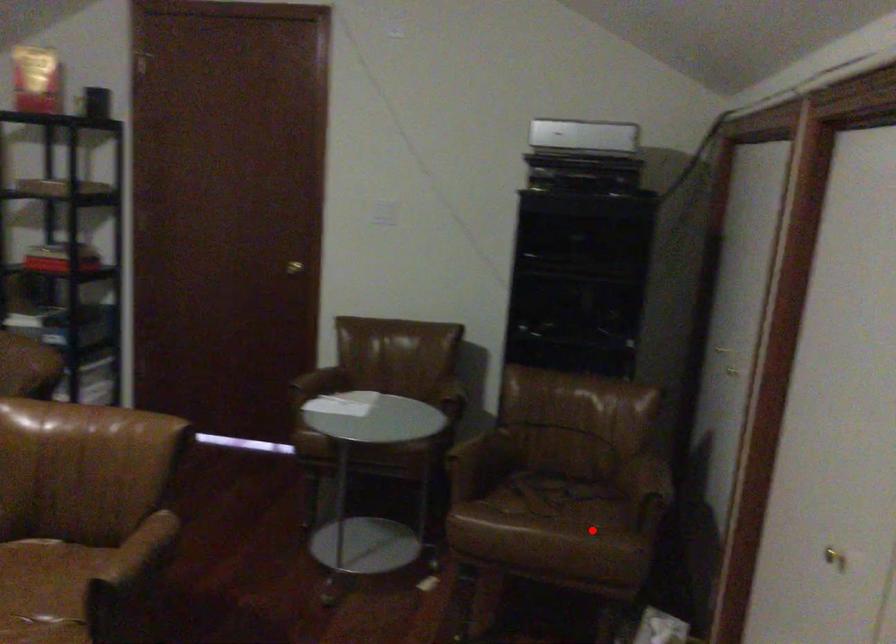
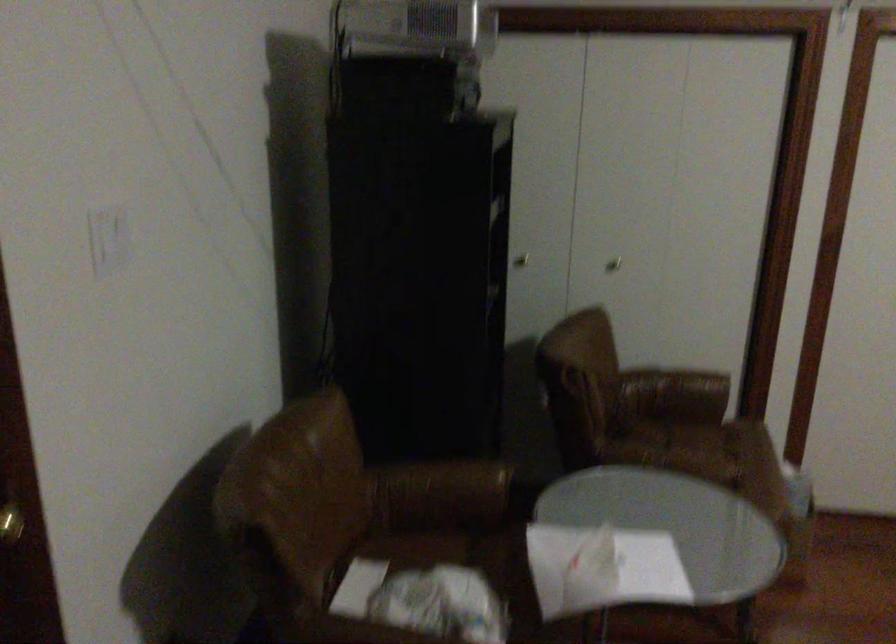
In the second image, find the point that corresponds to the highlighted location in the first image.

(718, 442)